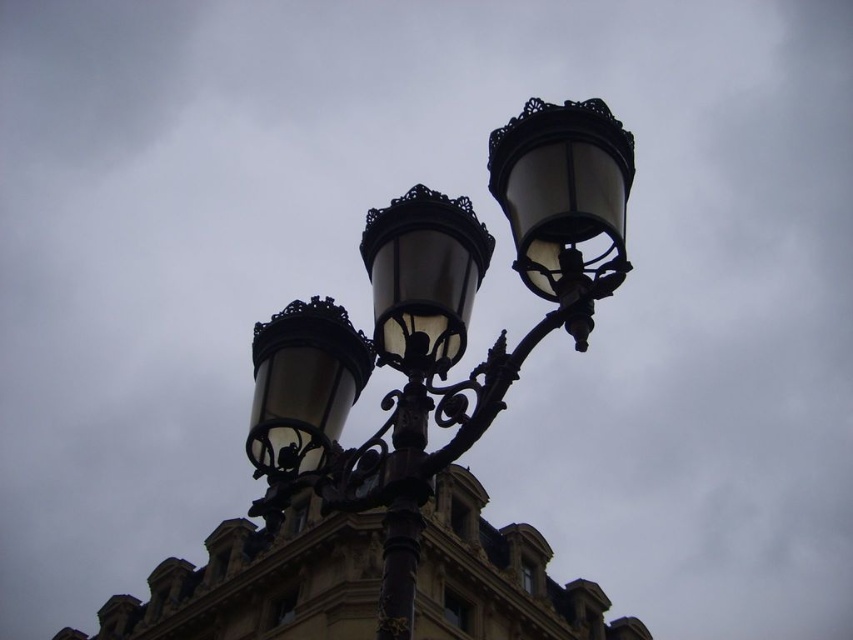
Question: Is matte black street light at center to the right of matte black lamp at upper right from the viewer's perspective?

Choices:
 (A) no
 (B) yes

Answer: (A)

Question: Estimate the real-world distances between objects in this image. Which object is farther from the matte black street light at center?

Choices:
 (A) black wrought iron pole at center
 (B) matte black lamp at upper right

Answer: (A)

Question: Is matte black lamp at upper right to the left of black wrought iron pole at center from the viewer's perspective?

Choices:
 (A) yes
 (B) no

Answer: (B)

Question: Considering the relative positions of matte black lamp at upper right and black wrought iron pole at center in the image provided, where is matte black lamp at upper right located with respect to black wrought iron pole at center?

Choices:
 (A) right
 (B) left

Answer: (A)

Question: Among these points, which one is farthest from the camera?

Choices:
 (A) tap(399, 602)
 (B) tap(515, 214)

Answer: (B)

Question: Which point is farther to the camera?

Choices:
 (A) (607, 141)
 (B) (410, 492)

Answer: (A)